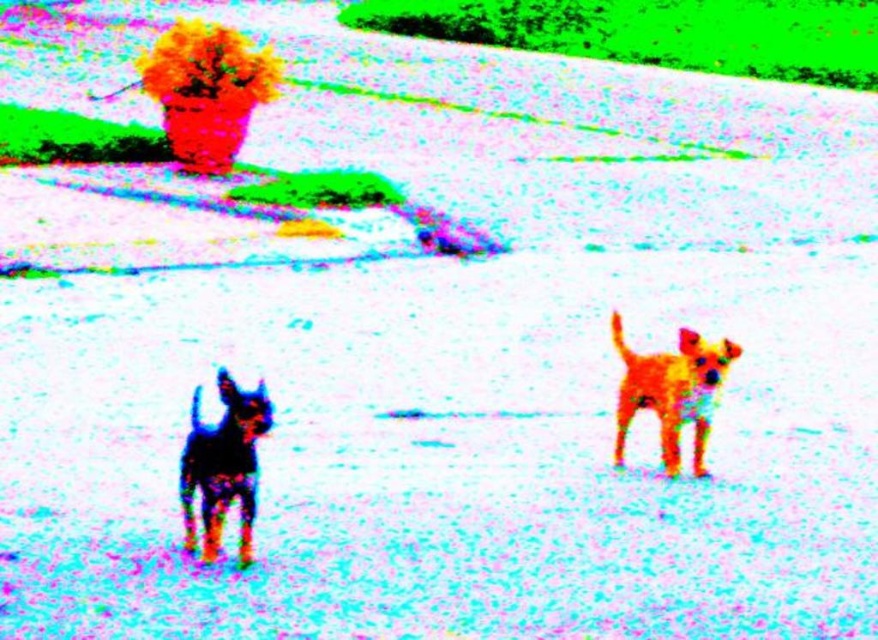
Can you confirm if black glossy dog at left is bigger than shiny golden dog at center?

Actually, black glossy dog at left might be smaller than shiny golden dog at center.

Does point (249, 525) lie behind point (706, 436)?

That is False.

Identify the location of black glossy dog at left. This screenshot has height=640, width=878. (222, 465).